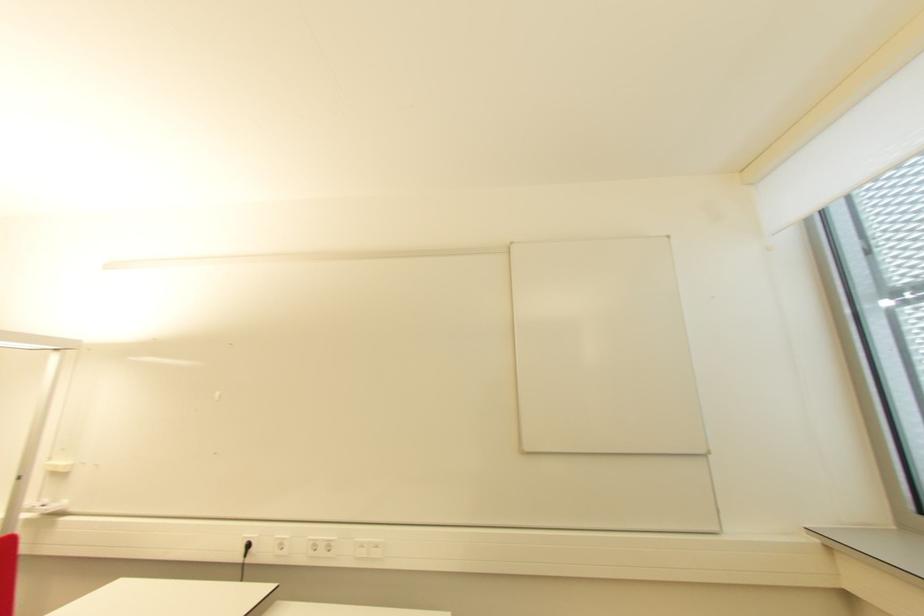
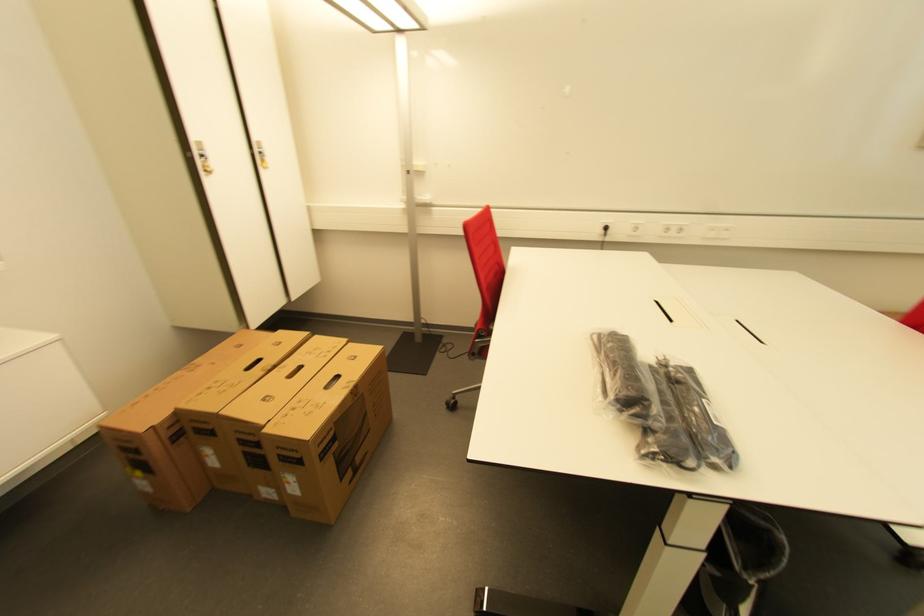
In the second image, find the point that corresponds to the point at 253,546 in the first image.

(611, 230)